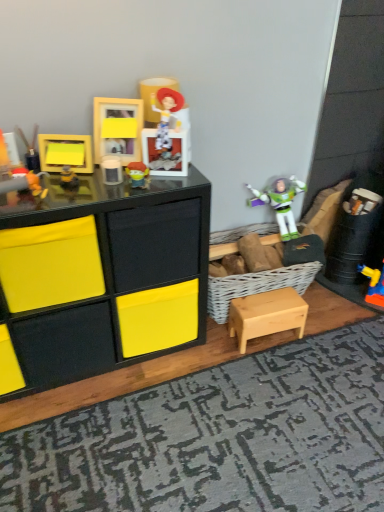
The image size is (384, 512). I want to click on vacant space to the left of matte yellow frame at upper left, which ranks as the 3th toy in right-to-left order, so click(43, 182).